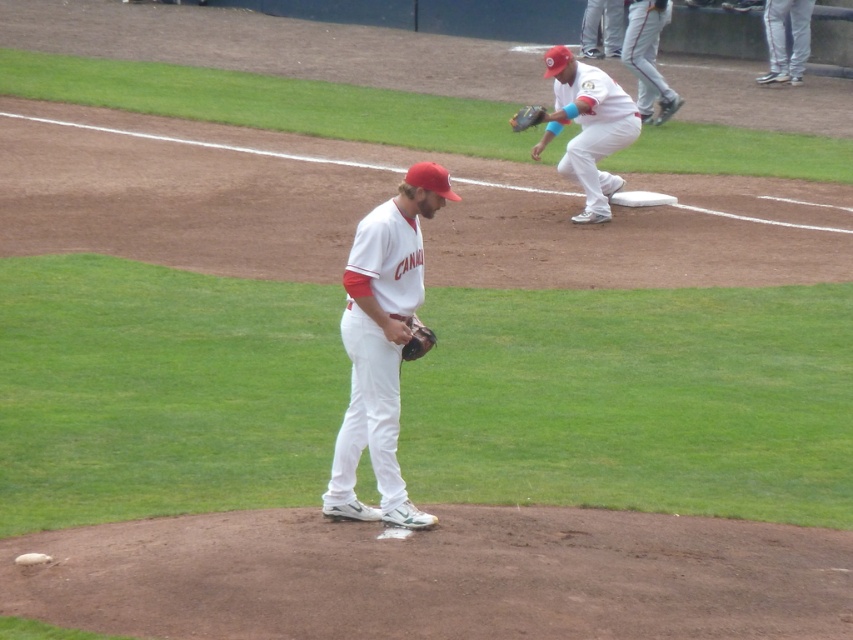
Question: Which object appears closest to the camera in this image?

Choices:
 (A) brown leather glove at center
 (B) white baseball uniform at upper right
 (C) white fabric pants at upper right
 (D) dark brown leather glove at upper center

Answer: (A)

Question: Is white baseball uniform at upper right wider than brown leather glove at center?

Choices:
 (A) yes
 (B) no

Answer: (A)

Question: Is white matte uniform at upper center below brown leather glove at center?

Choices:
 (A) no
 (B) yes

Answer: (A)

Question: Is white matte uniform at upper center below dark brown leather glove at upper center?

Choices:
 (A) no
 (B) yes

Answer: (B)

Question: Which point is closer to the camera?

Choices:
 (A) (636, 0)
 (B) (376, 227)
 (C) (614, 10)
 (D) (514, 129)

Answer: (B)

Question: Which object is farther from the camera taking this photo?

Choices:
 (A) white matte uniform at center
 (B) white matte uniform at upper center
 (C) white baseball uniform at upper right
 (D) brown leather glove at center

Answer: (C)